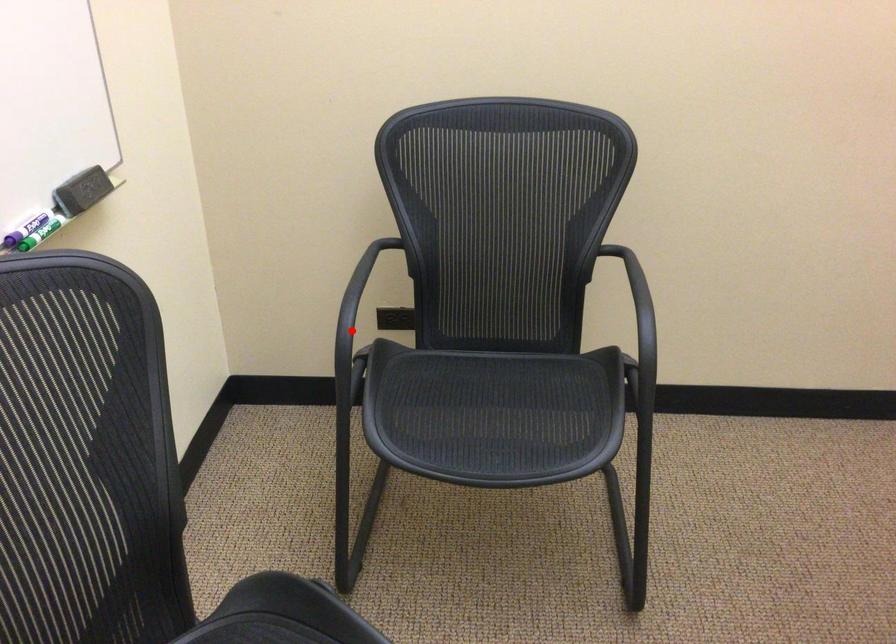
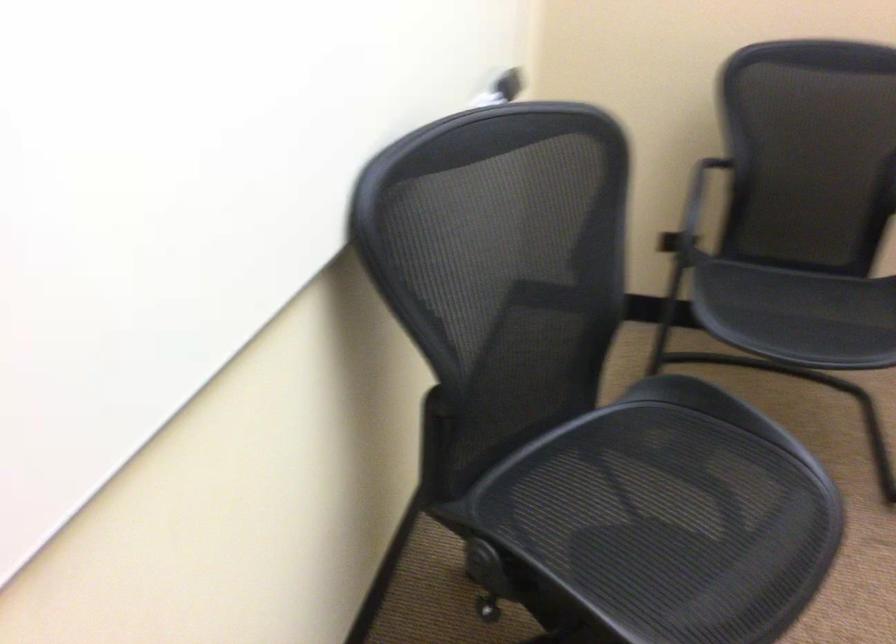
Question: A red point is marked in image1. In image2, is the corresponding 3D point closer to the camera or farther? Reply with the corresponding letter.

Choices:
 (A) The corresponding 3D point is closer.
 (B) The corresponding 3D point is farther.

Answer: (B)